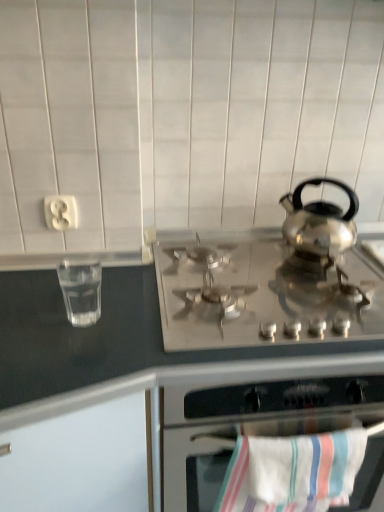
Question: Can you confirm if striped cotton beach towel at lower center is positioned to the right of satin silver gas stove at center?

Choices:
 (A) yes
 (B) no

Answer: (B)

Question: Could you tell me if striped cotton beach towel at lower center is turned towards satin silver gas stove at center?

Choices:
 (A) no
 (B) yes

Answer: (A)

Question: Does striped cotton beach towel at lower center have a lesser width compared to satin silver gas stove at center?

Choices:
 (A) yes
 (B) no

Answer: (A)

Question: From a real-world perspective, is striped cotton beach towel at lower center over satin silver gas stove at center?

Choices:
 (A) yes
 (B) no

Answer: (B)

Question: Does striped cotton beach towel at lower center have a greater width compared to satin silver gas stove at center?

Choices:
 (A) no
 (B) yes

Answer: (A)

Question: Is striped cotton beach towel at lower center in contact with satin silver gas stove at center?

Choices:
 (A) yes
 (B) no

Answer: (B)

Question: Is satin silver gas stove at center far from clear glass water at left?

Choices:
 (A) no
 (B) yes

Answer: (A)

Question: Is satin silver gas stove at center at the right side of clear glass water at left?

Choices:
 (A) no
 (B) yes

Answer: (B)

Question: Is satin silver gas stove at center positioned with its back to clear glass water at left?

Choices:
 (A) yes
 (B) no

Answer: (B)

Question: Is satin silver gas stove at center behind clear glass water at left?

Choices:
 (A) no
 (B) yes

Answer: (A)

Question: Considering the relative sizes of satin silver gas stove at center and clear glass water at left in the image provided, is satin silver gas stove at center thinner than clear glass water at left?

Choices:
 (A) yes
 (B) no

Answer: (B)

Question: Does satin silver gas stove at center have a smaller size compared to clear glass water at left?

Choices:
 (A) no
 (B) yes

Answer: (A)

Question: Does clear glass water at left have a smaller size compared to satin silver gas stove at center?

Choices:
 (A) no
 (B) yes

Answer: (B)